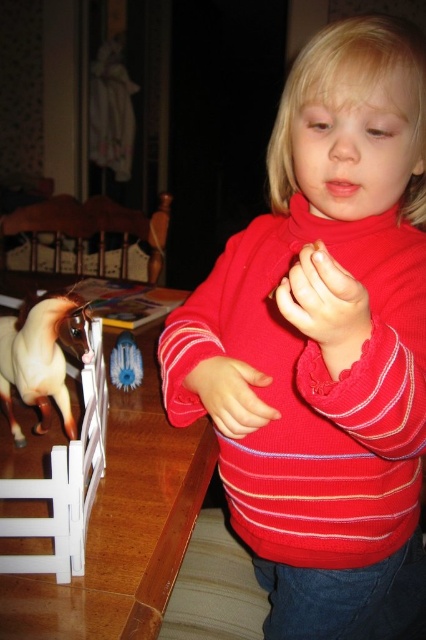
Find the location of a particular element. red striped sweater at center is located at coordinates (325, 346).

Is red striped sweater at center above brown glossy horse at left?

No.

Who is more forward, (388, 333) or (39, 342)?

Positioned in front is point (388, 333).

This screenshot has width=426, height=640. In order to click on red striped sweater at center in this screenshot , I will do `click(325, 346)`.

Does brown wooden table at lower left appear over brown glossy horse at left?

Indeed, brown wooden table at lower left is positioned over brown glossy horse at left.

Is point (140, 440) positioned in front of point (80, 337)?

No.

Describe the element at coordinates (123, 522) in the screenshot. I see `brown wooden table at lower left` at that location.

This screenshot has width=426, height=640. What are the coordinates of `brown wooden table at lower left` in the screenshot? It's located at (123, 522).

What do you see at coordinates (325, 346) in the screenshot?
I see `red striped sweater at center` at bounding box center [325, 346].

Image resolution: width=426 pixels, height=640 pixels. What do you see at coordinates (325, 346) in the screenshot?
I see `red striped sweater at center` at bounding box center [325, 346].

At what (x,y) coordinates should I click in order to perform the action: click on red striped sweater at center. Please return your answer as a coordinate pair (x, y). The image size is (426, 640). Looking at the image, I should click on (325, 346).